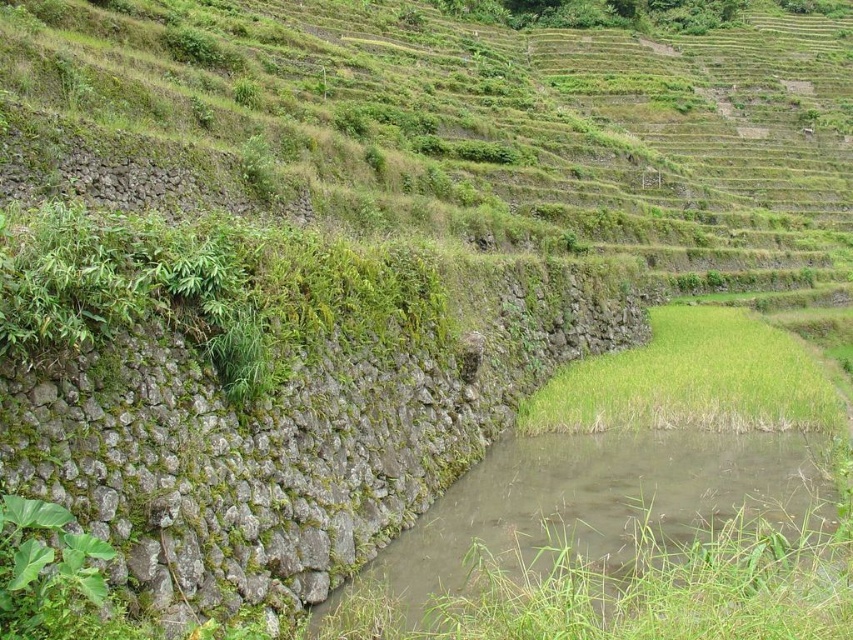
Can you confirm if green mossy wall at center-left is wider than green grass at lower right?

No.

Image resolution: width=853 pixels, height=640 pixels. I want to click on green mossy wall at center-left, so click(204, 291).

At what (x,y) coordinates should I click in order to perform the action: click on green mossy wall at center-left. Please return your answer as a coordinate pair (x, y). Image resolution: width=853 pixels, height=640 pixels. Looking at the image, I should click on (204, 291).

Is muddy stone stream at lower center wider than green grass at lower right?

Indeed, muddy stone stream at lower center has a greater width compared to green grass at lower right.

The image size is (853, 640). I want to click on muddy stone stream at lower center, so point(581,515).

Is point (387, 547) farther from camera compared to point (724, 392)?

That is False.

Locate an element on the screen. This screenshot has height=640, width=853. muddy stone stream at lower center is located at coordinates (581, 515).

Is green mossy wall at center-left to the right of muddy stone stream at lower center from the viewer's perspective?

Incorrect, green mossy wall at center-left is not on the right side of muddy stone stream at lower center.

Which is more to the left, green mossy wall at center-left or muddy stone stream at lower center?

green mossy wall at center-left is more to the left.

At what (x,y) coordinates should I click in order to perform the action: click on green mossy wall at center-left. Please return your answer as a coordinate pair (x, y). Looking at the image, I should click on (204, 291).